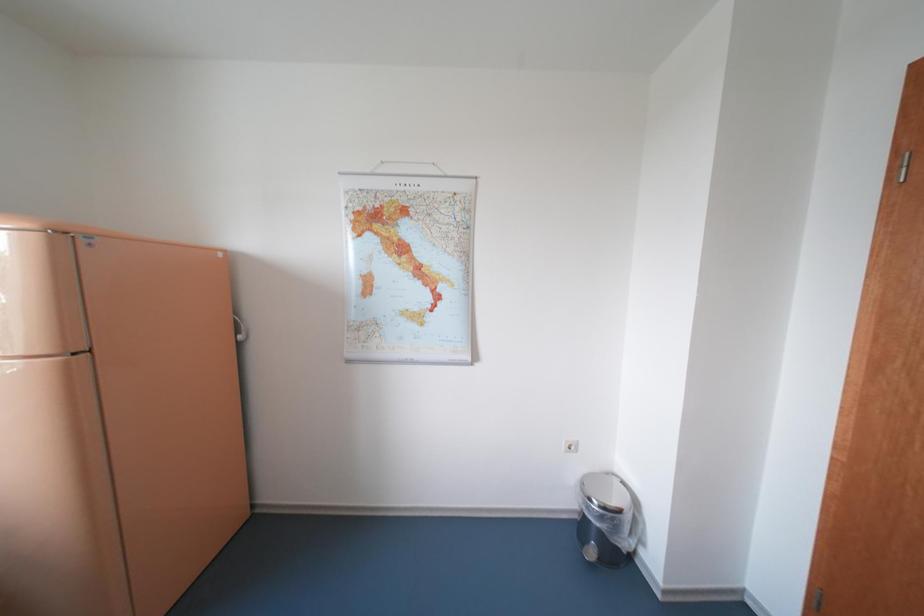
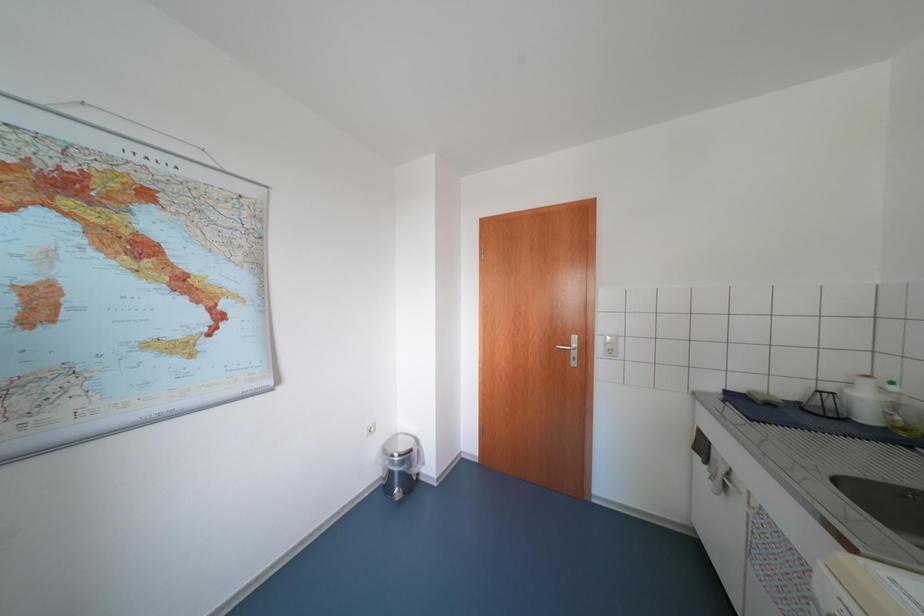
Question: The camera is either moving clockwise (left) or counter-clockwise (right) around the object. The first image is from the beginning of the video and the second image is from the end. Is the camera moving left or right when shooting the video?

Choices:
 (A) Left
 (B) Right

Answer: (A)